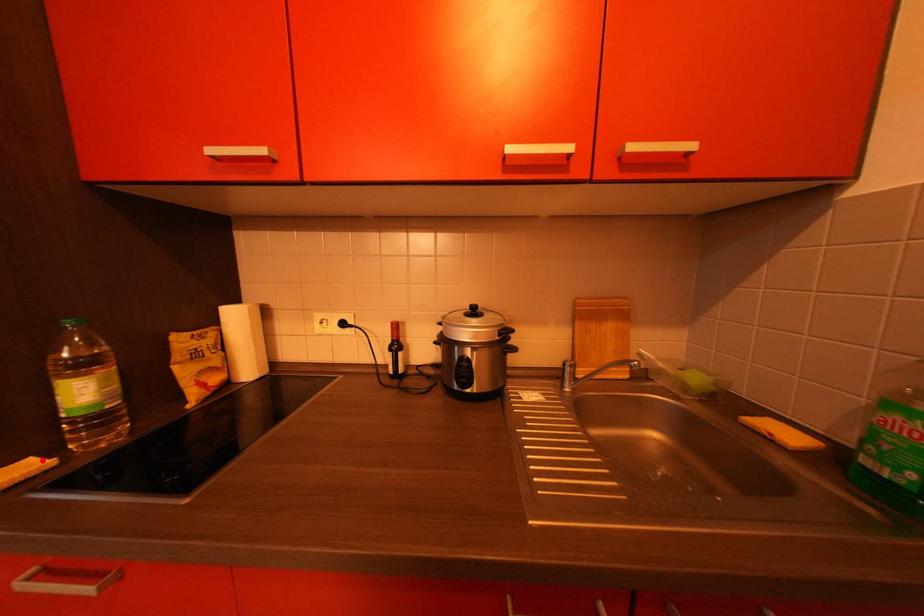
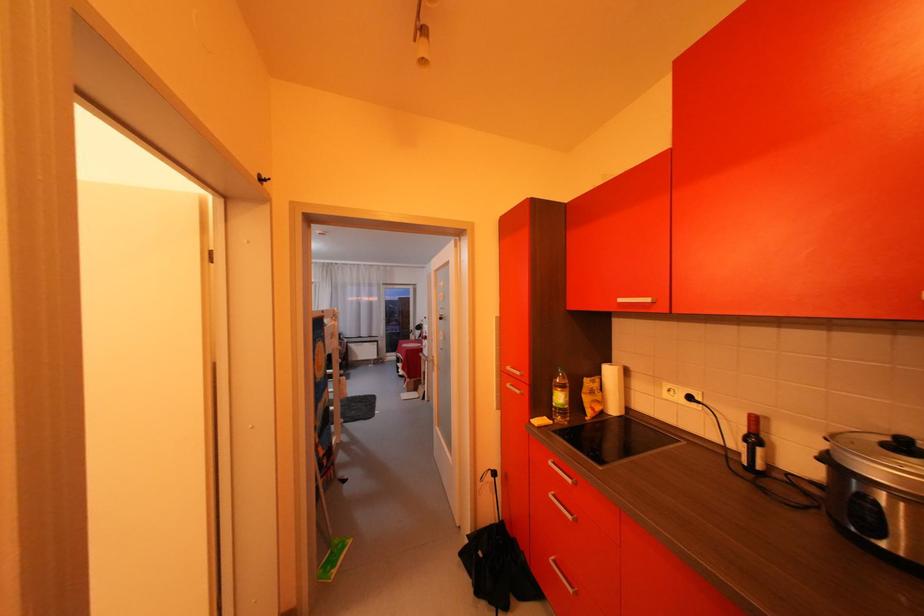
In the second image, find the point that corresponds to the highlighted location in the first image.

(556, 419)